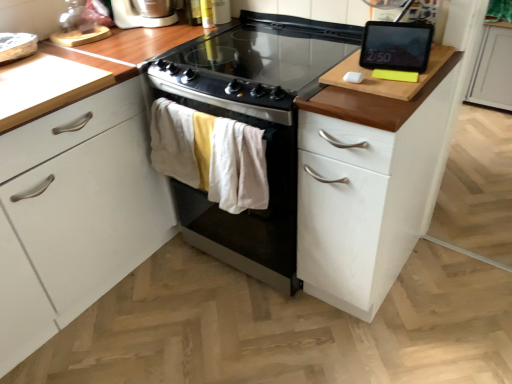
I want to click on vacant area to the left of black glass-top oven at center, so click(x=156, y=286).